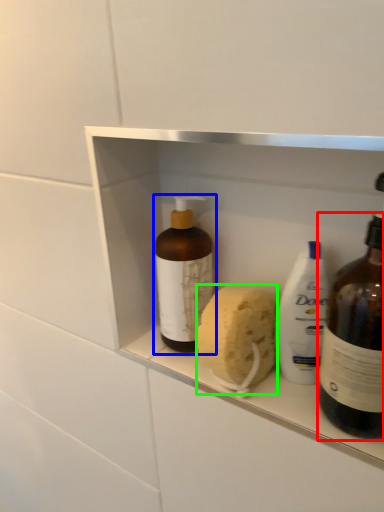
Question: Which is nearer to the bottle (highlighted by a red box)? bottle (highlighted by a blue box) or soap (highlighted by a green box).

Choices:
 (A) bottle
 (B) soap

Answer: (B)